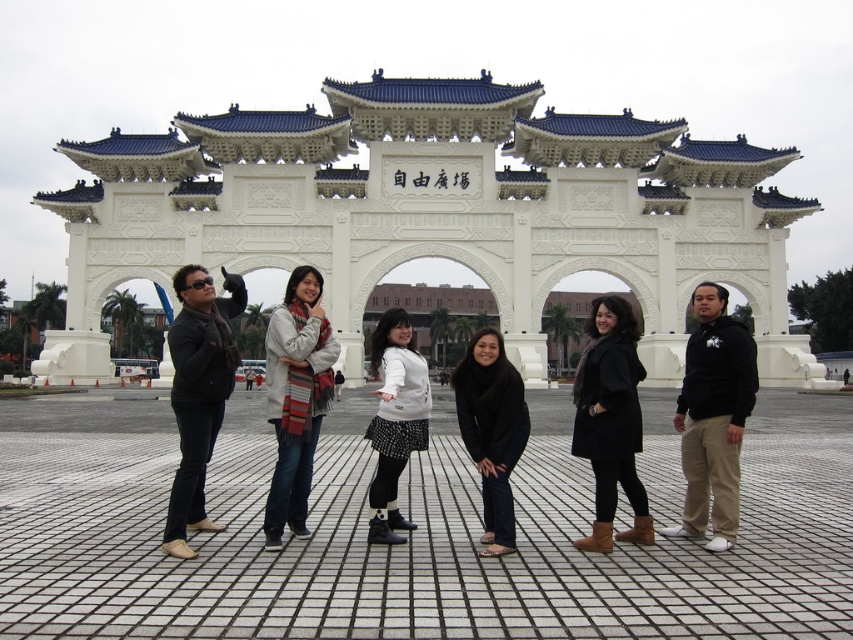
Question: Can you confirm if black matte coat at center is bigger than white matte sweater at center?

Choices:
 (A) no
 (B) yes

Answer: (B)

Question: Which point is closer to the camera?

Choices:
 (A) black matte pants at center
 (B) striped scarf at center

Answer: (A)

Question: Can you confirm if white stone gate at center is smaller than black matte coat at center?

Choices:
 (A) yes
 (B) no

Answer: (B)

Question: Which of the following is the closest to the observer?

Choices:
 (A) black matte coat at center
 (B) white matte sweater at center

Answer: (A)

Question: Does black matte coat at center have a greater width compared to striped scarf at center?

Choices:
 (A) no
 (B) yes

Answer: (B)

Question: Which object is closer to the camera taking this photo?

Choices:
 (A) black matte coat at center
 (B) white matte sweater at center
 (C) white stone gate at center
 (D) black matte pants at center

Answer: (D)